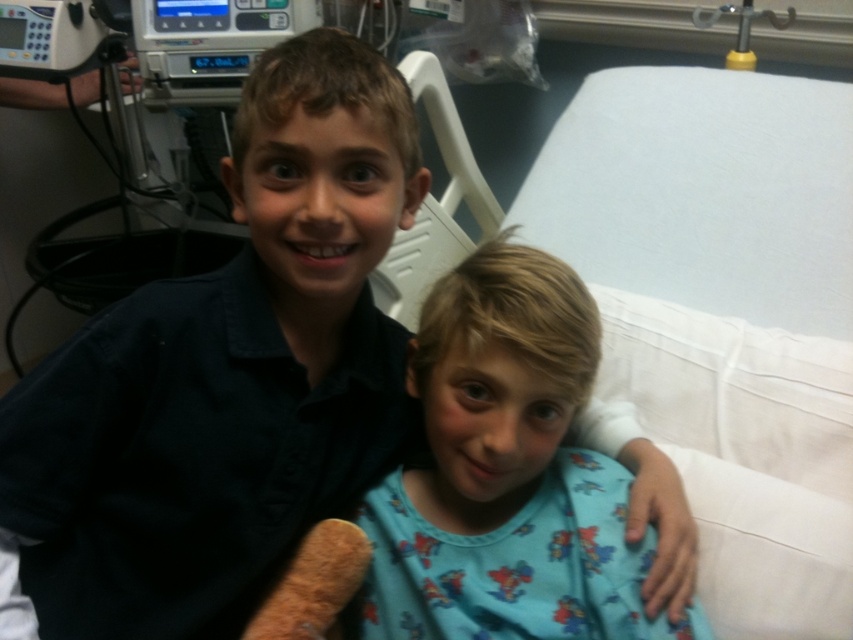
Does point (654, 88) come behind point (438, 637)?

Yes, it is behind point (438, 637).

Is point (535, 228) less distant than point (445, 410)?

No, it is behind (445, 410).

The image size is (853, 640). In order to click on white fabric bed at center in this screenshot , I will do `click(723, 314)`.

The image size is (853, 640). In order to click on white fabric bed at center in this screenshot , I will do 723,314.